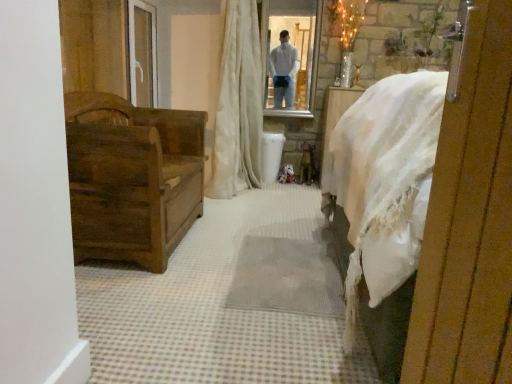
Question: Based on their positions, is dark brown wood chest at left located to the left or right of white textured curtain at center?

Choices:
 (A) left
 (B) right

Answer: (A)

Question: Is point (81, 243) positioned closer to the camera than point (247, 109)?

Choices:
 (A) farther
 (B) closer

Answer: (B)

Question: Which object is positioned farthest from the clear glass mirror at upper center?

Choices:
 (A) white textured curtain at center
 (B) wooden chest at left
 (C) dark brown wood chest at left

Answer: (B)

Question: Which object is the farthest from the clear glass mirror at upper center?

Choices:
 (A) wooden chest at left
 (B) white textured curtain at center
 (C) dark brown wood chest at left

Answer: (A)